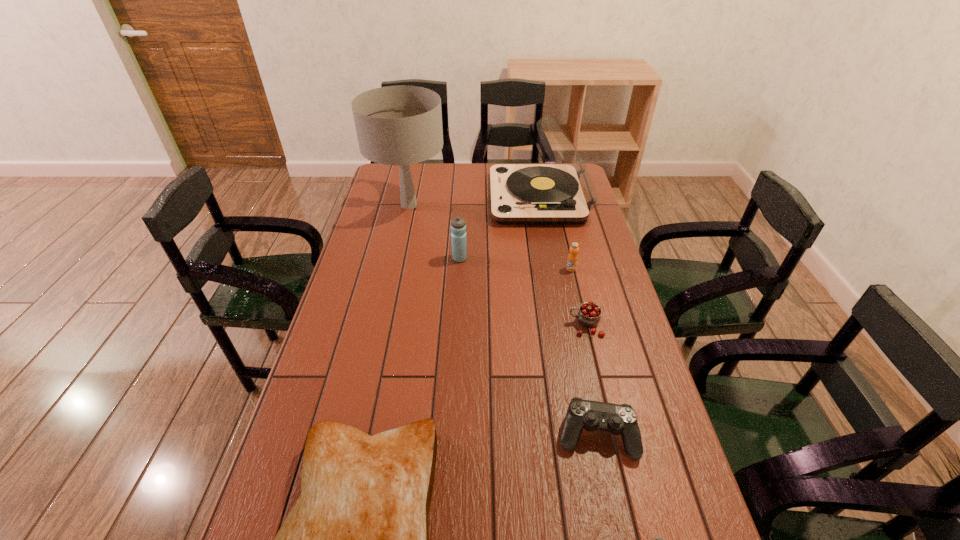
Locate an element on the screen. This screenshot has width=960, height=540. record player that is at the right edge is located at coordinates (562, 192).

Find the location of a particular element. The width and height of the screenshot is (960, 540). orange juice that is positioned at the right edge is located at coordinates (572, 260).

Find the location of a particular element. cherry that is at the right edge is located at coordinates (589, 313).

Identify the location of control that is positioned at the right edge. (617, 419).

The width and height of the screenshot is (960, 540). Identify the location of object located in the far left corner section of the desktop. (400, 125).

Where is `object at the far right corner`? Image resolution: width=960 pixels, height=540 pixels. object at the far right corner is located at coordinates (562, 192).

Identify the location of free space at the far edge of the desktop. Image resolution: width=960 pixels, height=540 pixels. (482, 185).

At what (x,y) coordinates should I click in order to perform the action: click on vacant space at the left edge of the desktop. Please return your answer as a coordinate pair (x, y). The width and height of the screenshot is (960, 540). Looking at the image, I should click on (384, 198).

In the image, there is a desktop. Identify the location of vacant space at the right edge. The image size is (960, 540). click(x=600, y=252).

Where is `free point between the second tallest object and the fifth nearest object`? This screenshot has width=960, height=540. free point between the second tallest object and the fifth nearest object is located at coordinates (555, 234).